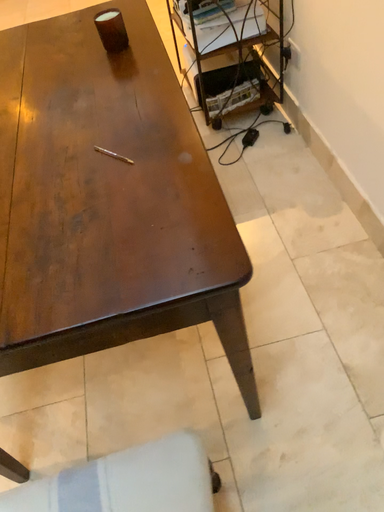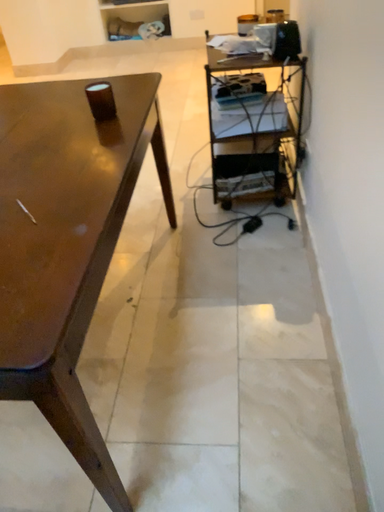
Question: How did the camera likely rotate when shooting the video?

Choices:
 (A) rotated upward
 (B) rotated downward

Answer: (A)